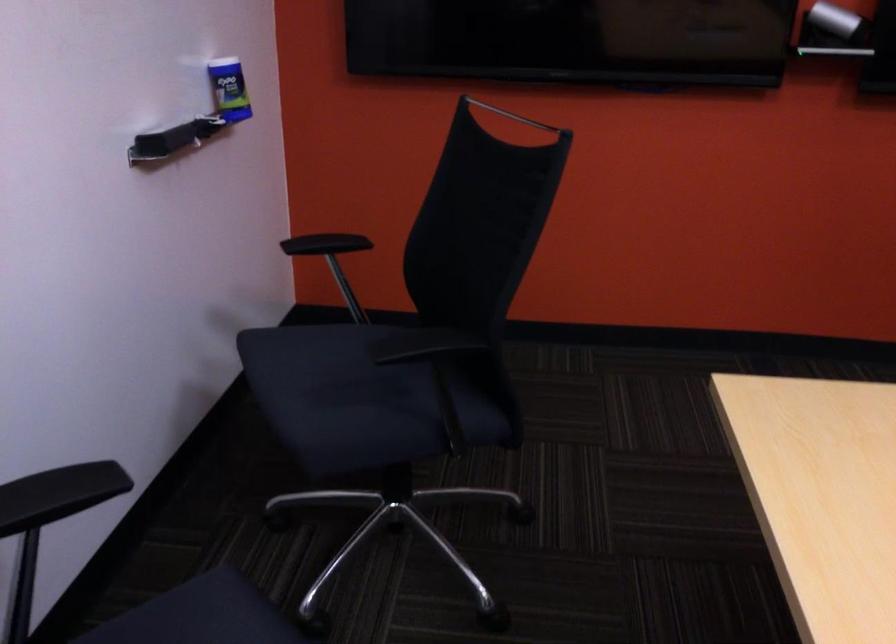
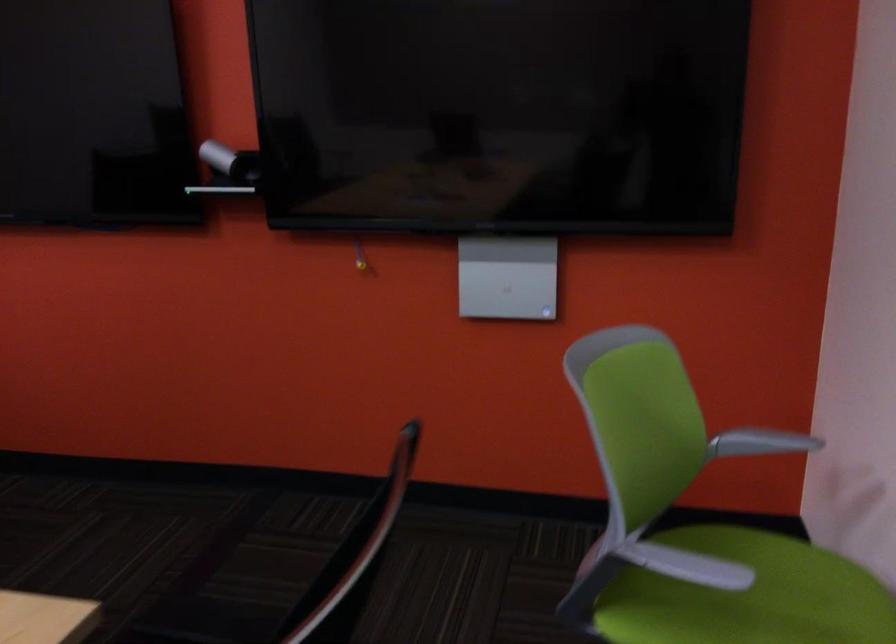
Question: The images are taken continuously from a first-person perspective. In which direction are you moving?

Choices:
 (A) Left
 (B) Right
 (C) Forward
 (D) Backward

Answer: (B)